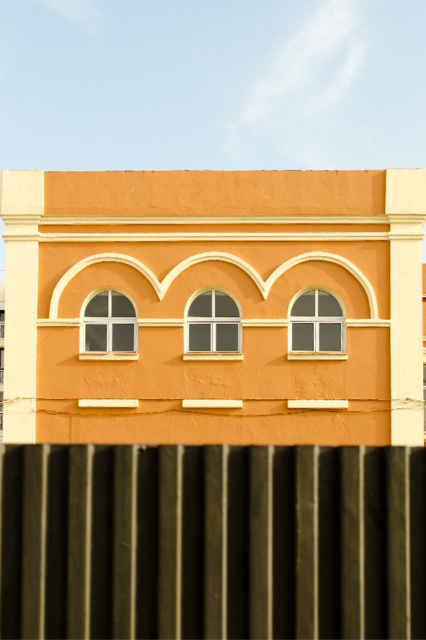
Locate an element on the screen. Image resolution: width=426 pixels, height=640 pixels. clear glass window at center is located at coordinates (316, 323).

From the picture: Who is more distant from viewer, (293, 323) or (101, 342)?

The point (101, 342) is behind.

Measure the distance between clear glass window at center and camera.

clear glass window at center and camera are 25.06 meters apart.

Where is `clear glass window at center`? clear glass window at center is located at coordinates pos(316,323).

Can you confirm if black corrugated metal fence at lower center is taller than white glass window at center?

Incorrect, black corrugated metal fence at lower center's height is not larger of white glass window at center's.

Is point (43, 548) closer to viewer compared to point (236, 307)?

Yes, point (43, 548) is in front of point (236, 307).

You are a GUI agent. You are given a task and a screenshot of the screen. Output one action in this format:
    pyautogui.click(x=<x>, y=<y>)
    Task: Click on the black corrugated metal fence at lower center
    This screenshot has width=426, height=640.
    Given the screenshot: What is the action you would take?
    pyautogui.click(x=212, y=541)

Which of these two, white glass window at center or white glass window at upper left, stands shorter?

white glass window at center is shorter.

The image size is (426, 640). What do you see at coordinates (213, 323) in the screenshot?
I see `white glass window at center` at bounding box center [213, 323].

At what (x,y) coordinates should I click in order to perform the action: click on white glass window at center. Please return your answer as a coordinate pair (x, y). Looking at the image, I should click on (213, 323).